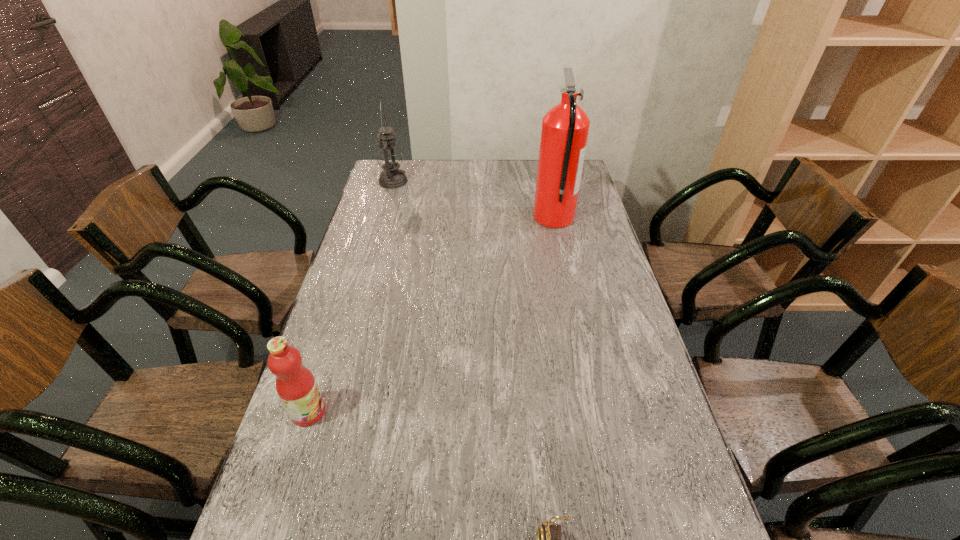
Identify the location of free space between the tallest object and the oil lamp. (473, 200).

Locate an element on the screen. unoccupied position between the third tallest object and the farthest object is located at coordinates (350, 297).

Find the location of a particular element. This screenshot has height=540, width=960. free area in between the fruit juice and the farthest object is located at coordinates (350, 297).

You are a GUI agent. You are given a task and a screenshot of the screen. Output one action in this format:
    pyautogui.click(x=<x>, y=<y>)
    Task: Click on the object that ranks as the third closest to the third object from left to right
    This screenshot has width=960, height=540.
    Given the screenshot: What is the action you would take?
    pyautogui.click(x=389, y=157)

Choose which object is the second nearest neighbor to the nearest object. Please provide its 2D coordinates. Your answer should be formatted as a tuple, i.e. [(x, y)], where the tuple contains the x and y coordinates of a point satisfying the conditions above.

[(565, 127)]